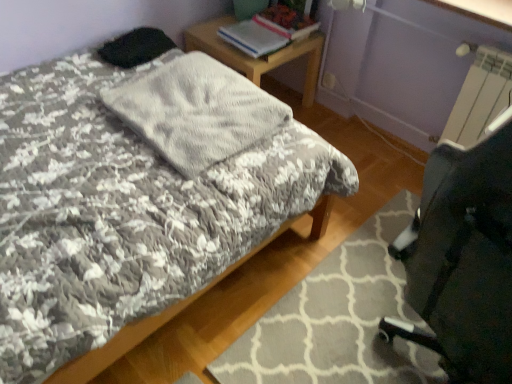
Question: From the image's perspective, is hardcover book at upper center, positioned as the 1th book in left-to-right order, positioned above or below hardcover book at upper center, which appears as the first book when viewed from the right?

Choices:
 (A) above
 (B) below

Answer: (B)

Question: Is point (312, 23) closer or farther from the camera than point (297, 33)?

Choices:
 (A) farther
 (B) closer

Answer: (A)

Question: Which of these objects is positioned farthest from the hardcover book at upper center, positioned as the 1th book in left-to-right order?

Choices:
 (A) wooden desk at upper center
 (B) hardcover book at upper center, the second book in the left-to-right sequence
 (C) fluffy fabric bed at center
 (D) gray textured rug at lower right
 (E) fluffy gray blanket at center

Answer: (D)

Question: Estimate the real-world distances between objects in this image. Which object is closer to the wooden desk at upper center?

Choices:
 (A) hardcover book at upper center, the second book viewed from the right
 (B) fluffy gray blanket at center
 (C) gray textured rug at lower right
 (D) fluffy fabric bed at center
 (E) hardcover book at upper center, the second book in the left-to-right sequence

Answer: (A)